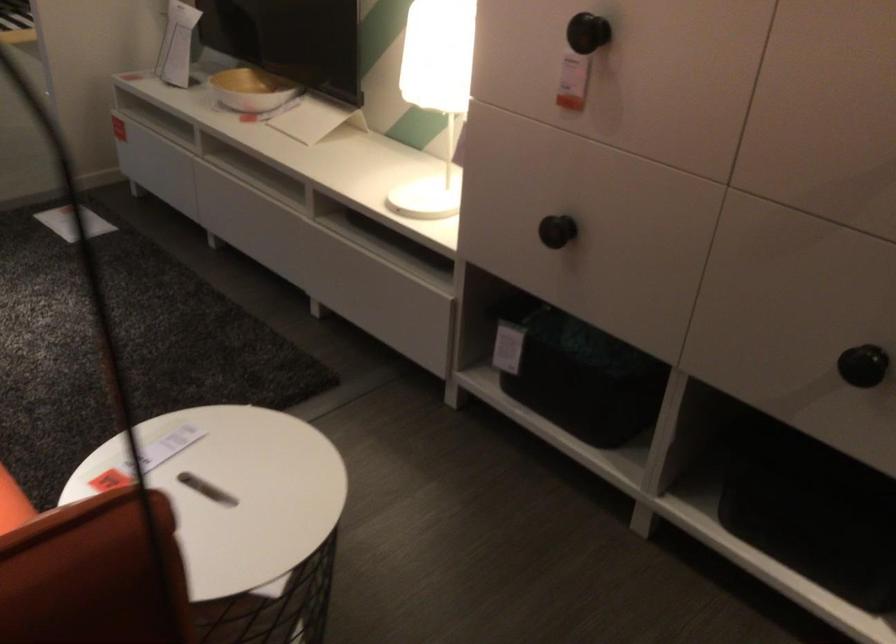
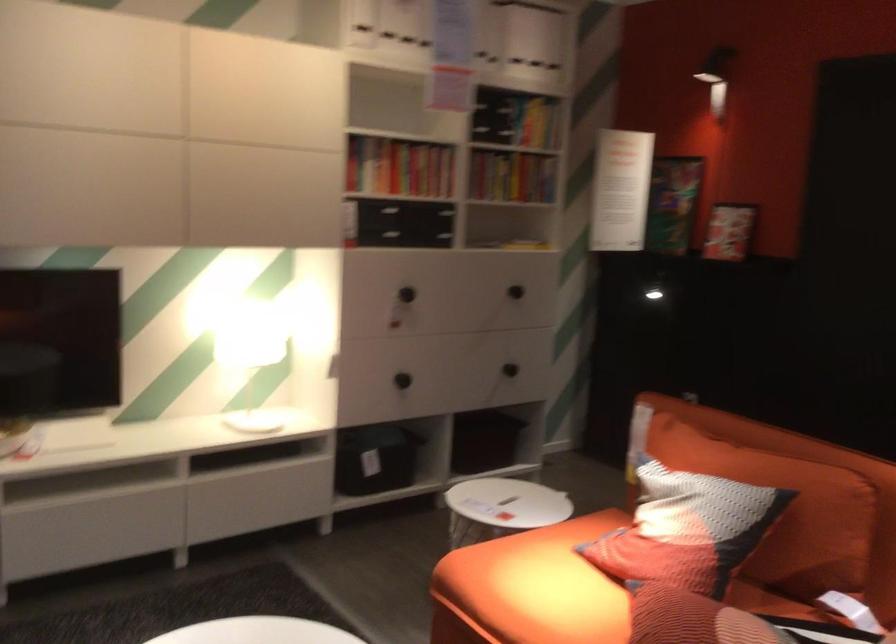
Where in the second image is the point corresponding to (487,339) from the first image?

(375, 459)